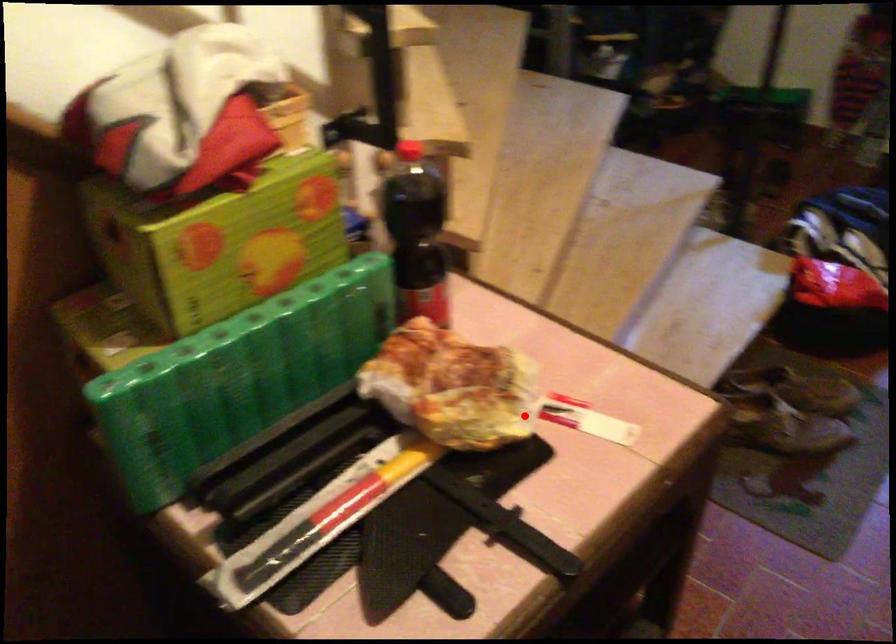
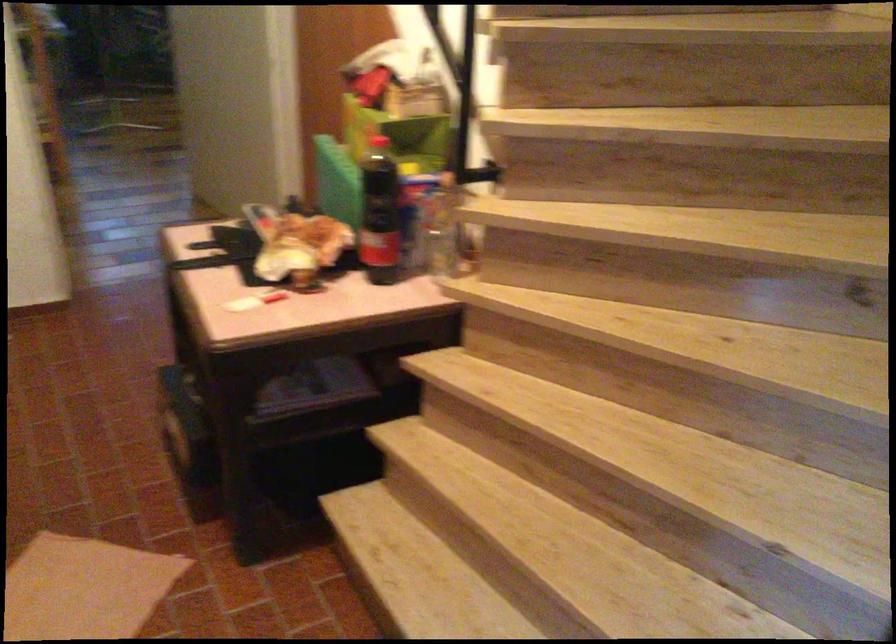
Question: I am providing you with two images of the same scene from different viewpoints. In image1, a red point is highlighted. Considering the same 3D point in image2, which of the following is correct?

Choices:
 (A) It is closer
 (B) It is farther

Answer: (B)